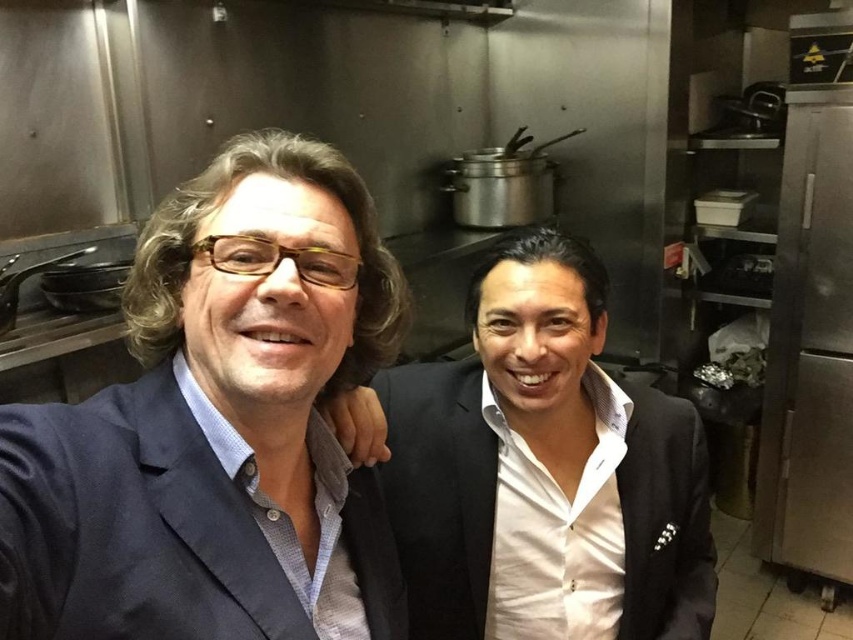
You are a photographer positioned in the kitchen and want to capture a clear photo of the matte black suit at left. Your camera has a minimum focusing distance of 18 inches. Can you take the photo without moving closer?

The distance between the matte black suit at left and the viewer is 18.17 inches, which is slightly beyond the camera minimum focusing distance of 18 inches. Therefore, you can take the photo without moving closer.

You are a fashion designer observing the two individuals in the commercial kitchen. You need to determine which item of clothing is smaller in size between the matte black suit at left and the white glossy shirt at center. Based on the scene, which one is smaller?

The matte black suit at left is smaller than the white glossy shirt at center according to the description.

Looking at this image, you are a photographer setting up a shoot in the commercial kitchen. You need to ensure that the matte black suit at left and the white glossy shirt at center are both visible in the frame. Given their height difference, which object should you adjust the camera angle to focus on first to capture both effectively?

The matte black suit at left is shorter than the white glossy shirt at center. To capture both effectively, adjust the camera angle to focus on the shorter matte black suit at left first, then ensure the taller white glossy shirt at center is in frame.